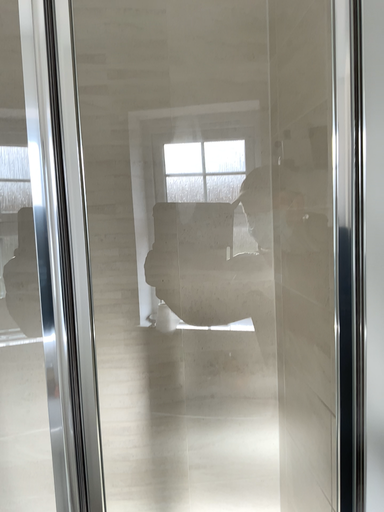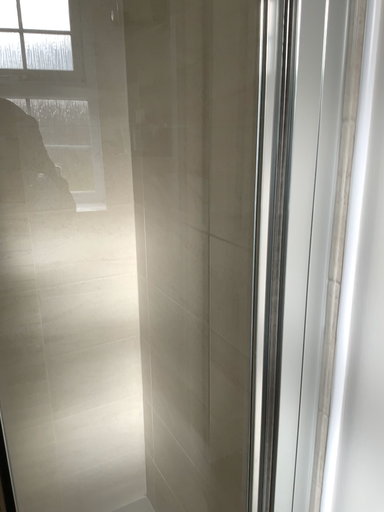
Question: How did the camera likely rotate when shooting the video?

Choices:
 (A) rotated right
 (B) rotated left

Answer: (A)